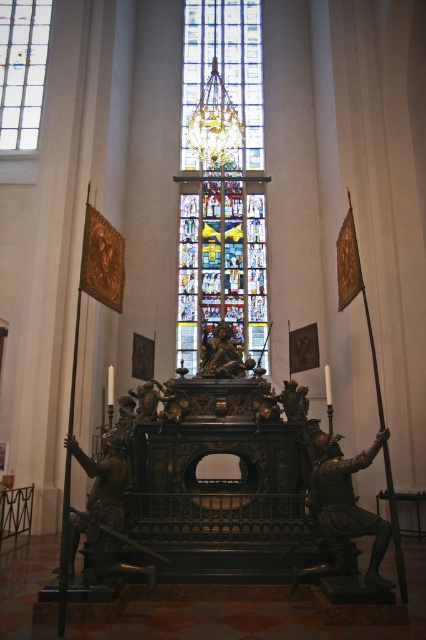
Question: Can you confirm if stained glass window at center is positioned above bronze statue at right?

Choices:
 (A) no
 (B) yes

Answer: (B)

Question: Estimate the real-world distances between objects in this image. Which object is closer to the multicolored stained glass at center?

Choices:
 (A) clear glass stained glass at upper center
 (B) stained glass window at center
 (C) polished bronze statue at center
 (D) bronze statue at right

Answer: (C)

Question: Among these objects, which one is farthest from the camera?

Choices:
 (A) polished bronze statue at center
 (B) clear glass stained glass at upper center
 (C) stained glass window at center
 (D) multicolored stained glass at center

Answer: (C)

Question: Is multicolored stained glass at center below bronze statue at right?

Choices:
 (A) no
 (B) yes

Answer: (A)

Question: Which object is closer to the camera taking this photo?

Choices:
 (A) stained glass window at center
 (B) bronze statue at right
 (C) polished bronze statue at center

Answer: (B)

Question: Can you confirm if multicolored stained glass at center is smaller than polished bronze statue at center?

Choices:
 (A) yes
 (B) no

Answer: (B)